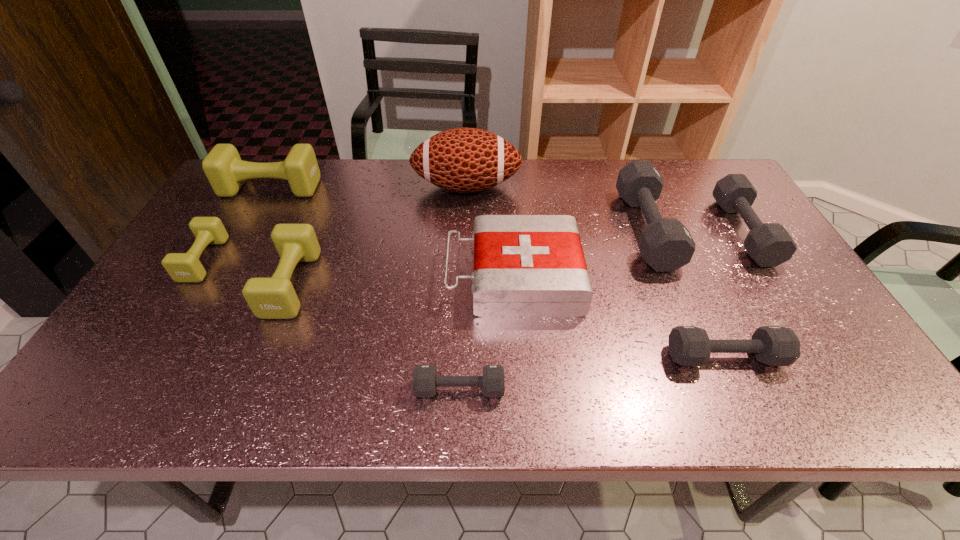
Image resolution: width=960 pixels, height=540 pixels. I want to click on vacant position at the right edge of the desktop, so click(853, 357).

In the image, there is a desktop. Find the location of `free space at the far right corner`. free space at the far right corner is located at coordinates (718, 171).

Where is `vacant region between the rightmost object and the biggest gray dumbbell`? vacant region between the rightmost object and the biggest gray dumbbell is located at coordinates (695, 230).

Image resolution: width=960 pixels, height=540 pixels. I want to click on vacant area that lies between the biggest gray dumbbell and the rightmost dumbbell, so click(x=695, y=230).

I want to click on free spot between the third farthest gray dumbbell and the smallest olive dumbbell, so click(x=465, y=308).

Image resolution: width=960 pixels, height=540 pixels. In order to click on empty location between the second nearest gray dumbbell and the first-aid kit in this screenshot , I will do `click(619, 316)`.

The height and width of the screenshot is (540, 960). What are the coordinates of `free point between the rightmost gray dumbbell and the biggest olive dumbbell` in the screenshot? It's located at (507, 210).

Where is `vacant area that lies between the third biggest gray dumbbell and the tallest object`? The width and height of the screenshot is (960, 540). vacant area that lies between the third biggest gray dumbbell and the tallest object is located at coordinates (596, 272).

Locate an element on the screen. The image size is (960, 540). unoccupied position between the eighth farthest object and the nearest dumbbell is located at coordinates (x=592, y=373).

Identify the location of free point between the farthest olive dumbbell and the smallest olive dumbbell. (237, 224).